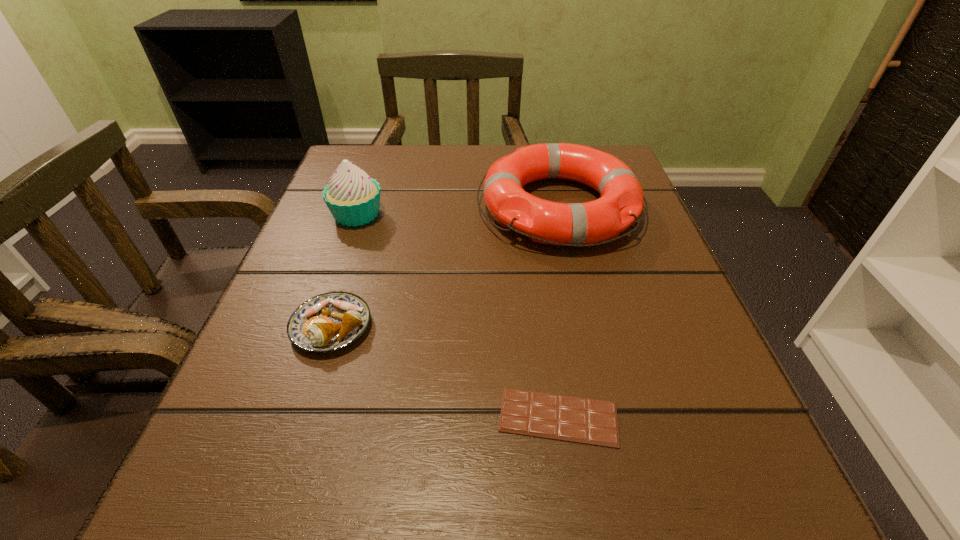
The width and height of the screenshot is (960, 540). Find the location of `free space at the left edge of the desktop`. free space at the left edge of the desktop is located at coordinates [x=286, y=340].

At what (x,y) coordinates should I click in order to perform the action: click on vacant space at the right edge. Please return your answer as a coordinate pair (x, y). This screenshot has height=540, width=960. Looking at the image, I should click on (659, 315).

Find the location of a particular element. This screenshot has height=540, width=960. vacant area at the far left corner of the desktop is located at coordinates (406, 147).

In the image, there is a desktop. At what (x,y) coordinates should I click in order to perform the action: click on vacant region at the near left corner. Please return your answer as a coordinate pair (x, y). The height and width of the screenshot is (540, 960). Looking at the image, I should click on (200, 507).

You are a GUI agent. You are given a task and a screenshot of the screen. Output one action in this format:
    pyautogui.click(x=<x>, y=<y>)
    Task: Click on the vacant space at the near right corner of the desktop
    Image resolution: width=960 pixels, height=540 pixels.
    Given the screenshot: What is the action you would take?
    pyautogui.click(x=682, y=514)

This screenshot has width=960, height=540. Identify the location of free space between the cupcake and the pastry. (345, 271).

Image resolution: width=960 pixels, height=540 pixels. Identify the location of vacant area between the life buoy and the nearest object. (559, 312).

Where is `vacant space that's between the third farthest object and the chocolate bar`? The height and width of the screenshot is (540, 960). vacant space that's between the third farthest object and the chocolate bar is located at coordinates (445, 372).

The image size is (960, 540). I want to click on free spot between the chocolate bar and the life buoy, so click(x=559, y=312).

The image size is (960, 540). I want to click on empty space that is in between the cupcake and the chocolate bar, so click(458, 316).